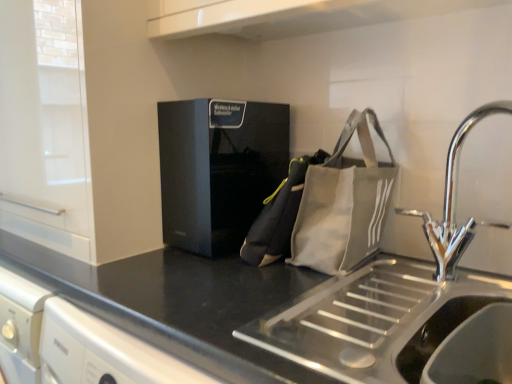
Question: Is the position of black matte countertop at center less distant than that of chrome metallic tap at right?

Choices:
 (A) yes
 (B) no

Answer: (A)

Question: Is black matte countertop at center at the right side of chrome metallic tap at right?

Choices:
 (A) yes
 (B) no

Answer: (B)

Question: Is black matte countertop at center outside of chrome metallic tap at right?

Choices:
 (A) yes
 (B) no

Answer: (A)

Question: From a real-world perspective, is black matte countertop at center located higher than chrome metallic tap at right?

Choices:
 (A) no
 (B) yes

Answer: (A)

Question: Is black matte countertop at center thinner than chrome metallic tap at right?

Choices:
 (A) no
 (B) yes

Answer: (A)

Question: Can you confirm if black matte countertop at center is positioned to the left of chrome metallic tap at right?

Choices:
 (A) yes
 (B) no

Answer: (A)

Question: Is gray canvas tote bag at right bigger than black matte cabinet at upper left?

Choices:
 (A) no
 (B) yes

Answer: (A)

Question: Is gray canvas tote bag at right positioned with its back to black matte cabinet at upper left?

Choices:
 (A) yes
 (B) no

Answer: (B)

Question: Considering the relative sizes of gray canvas tote bag at right and black matte cabinet at upper left in the image provided, is gray canvas tote bag at right smaller than black matte cabinet at upper left?

Choices:
 (A) yes
 (B) no

Answer: (A)

Question: Are gray canvas tote bag at right and black matte cabinet at upper left far apart?

Choices:
 (A) no
 (B) yes

Answer: (A)

Question: Could you tell me if gray canvas tote bag at right is facing black matte cabinet at upper left?

Choices:
 (A) no
 (B) yes

Answer: (A)

Question: Is gray canvas tote bag at right positioned in front of black matte cabinet at upper left?

Choices:
 (A) no
 (B) yes

Answer: (B)

Question: From a real-world perspective, is canvas messenger bag at center located beneath stainless steel sink at lower right?

Choices:
 (A) no
 (B) yes

Answer: (A)